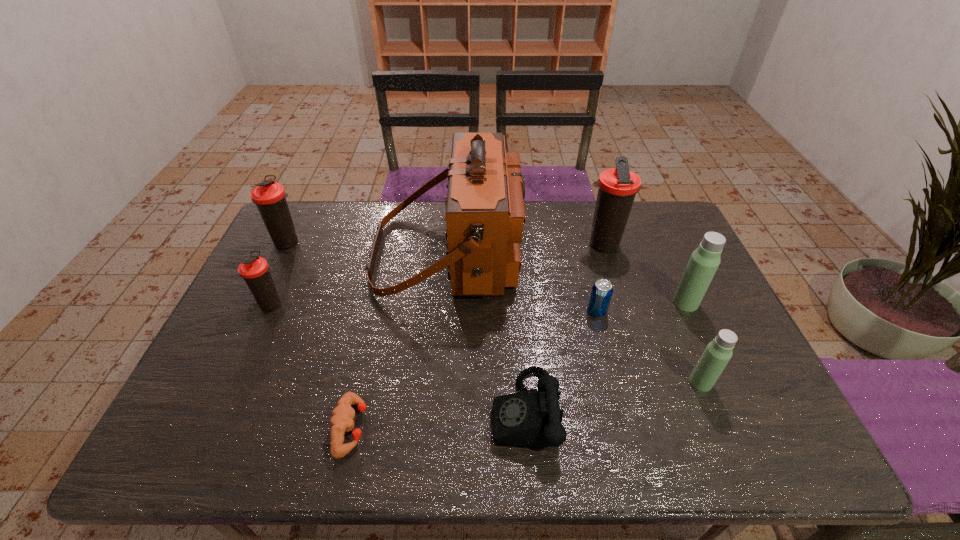
You are a GUI agent. You are given a task and a screenshot of the screen. Output one action in this format:
    pyautogui.click(x=<x>, y=<y>)
    Task: Click on the empty location between the blue beer can and the telephone
    The height and width of the screenshot is (540, 960).
    Given the screenshot: What is the action you would take?
    pyautogui.click(x=561, y=361)

Locate an element on the screen. The height and width of the screenshot is (540, 960). unoccupied position between the satchel and the red puncher is located at coordinates (399, 341).

Find the location of a particular element. vacant area that lies between the puncher and the brown satchel is located at coordinates (399, 341).

Find the location of a particular element. The height and width of the screenshot is (540, 960). free point between the tallest thermos bottle and the satchel is located at coordinates (525, 249).

Point out which object is positioned as the second nearest to the shortest object. Please provide its 2D coordinates. Your answer should be formatted as a tuple, i.e. [(x, y)], where the tuple contains the x and y coordinates of a point satisfying the conditions above.

[(531, 418)]

Locate which object is the second closest to the satchel. Please provide its 2D coordinates. Your answer should be formatted as a tuple, i.e. [(x, y)], where the tuple contains the x and y coordinates of a point satisfying the conditions above.

[(618, 186)]

Where is `thermos bottle that stands as the fourth closest to the telephone`? The image size is (960, 540). thermos bottle that stands as the fourth closest to the telephone is located at coordinates (255, 270).

Select which thermos bottle appears as the closest to the nearer light thermos bottle. Please provide its 2D coordinates. Your answer should be formatted as a tuple, i.e. [(x, y)], where the tuple contains the x and y coordinates of a point satisfying the conditions above.

[(704, 261)]

In order to click on brown thermos bottle that is the closest to the nearest brown thermos bottle in this screenshot , I will do `click(270, 197)`.

Identify which brown thermos bottle is the nearest to the nearest brown thermos bottle. Please provide its 2D coordinates. Your answer should be formatted as a tuple, i.e. [(x, y)], where the tuple contains the x and y coordinates of a point satisfying the conditions above.

[(270, 197)]